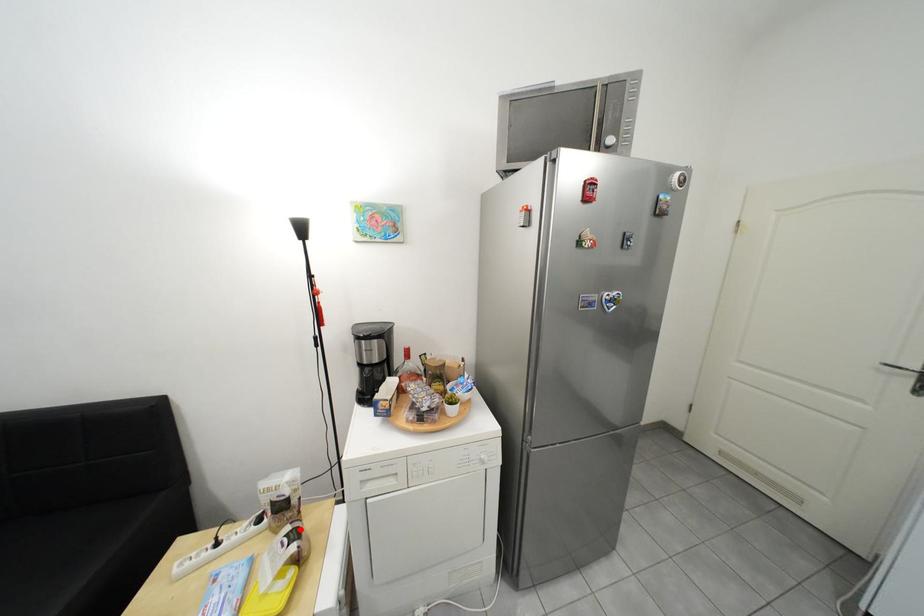
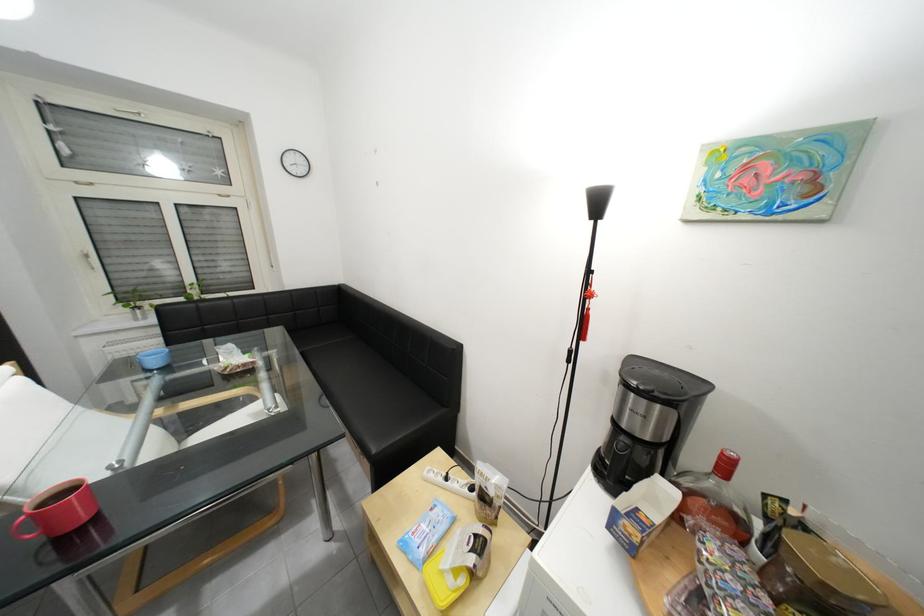
Question: I am providing you with two images of the same scene from different viewpoints. Image1 has a red point marked. In image2, the corresponding 3D location appears at what relative position? Reply with the corresponding letter.

Choices:
 (A) Closer
 (B) Farther

Answer: (B)